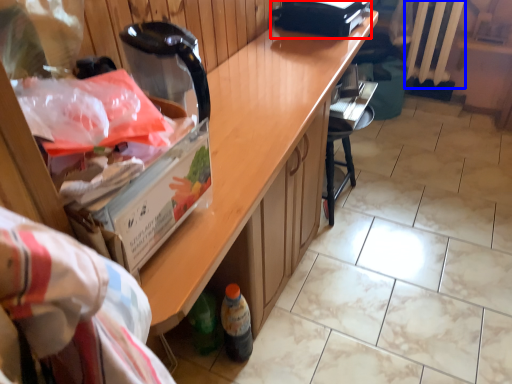
Question: Which object is further to the camera taking this photo, appliance (highlighted by a red box) or radiator (highlighted by a blue box)?

Choices:
 (A) appliance
 (B) radiator

Answer: (B)